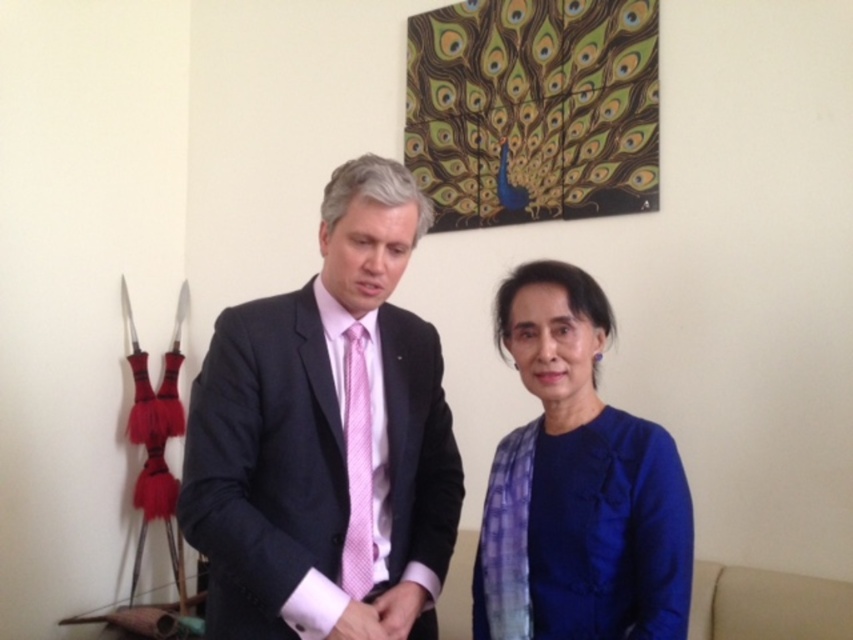
How much distance is there between blue cotton sweater at center and pink textured tie at center?

blue cotton sweater at center is 13.52 inches away from pink textured tie at center.

Image resolution: width=853 pixels, height=640 pixels. Describe the element at coordinates (577, 484) in the screenshot. I see `blue cotton sweater at center` at that location.

Is point (503, 621) in front of point (350, 404)?

Yes, point (503, 621) is closer to viewer.

Locate an element on the screen. blue cotton sweater at center is located at coordinates (577, 484).

Who is positioned more to the right, matte black suit at center or pink textured tie at center?

matte black suit at center

From the picture: Who is taller, matte black suit at center or pink textured tie at center?

With more height is matte black suit at center.

I want to click on matte black suit at center, so click(x=328, y=438).

Is point (300, 477) closer to viewer compared to point (602, 317)?

Yes.

Who is positioned more to the right, matte black suit at center or blue cotton sweater at center?

From the viewer's perspective, blue cotton sweater at center appears more on the right side.

Measure the distance between matte black suit at center and camera.

They are 4.12 feet apart.

Identify the location of matte black suit at center. The width and height of the screenshot is (853, 640). (328, 438).